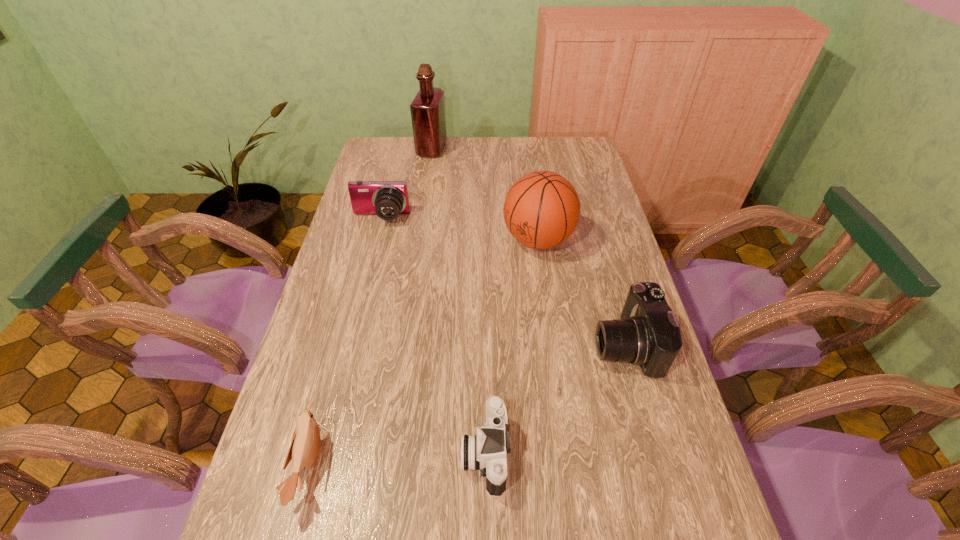
Where is `free location located 0.240m on the left of the basketball`? free location located 0.240m on the left of the basketball is located at coordinates (430, 240).

Locate an element on the screen. This screenshot has width=960, height=540. free space located 0.210m on the lens of the second farthest camera is located at coordinates (516, 345).

In order to click on vacant space located on the lens of the second farthest camera in this screenshot , I will do `click(467, 345)`.

Image resolution: width=960 pixels, height=540 pixels. Find the location of `free space located on the lens of the second farthest camera`. free space located on the lens of the second farthest camera is located at coordinates (485, 345).

At what (x,y) coordinates should I click in order to perform the action: click on free location located on the front-facing side of the leftmost camera. Please return your answer as a coordinate pair (x, y). This screenshot has width=960, height=540. Looking at the image, I should click on (368, 274).

Where is `vacant space located on the back of the nearest camera`? vacant space located on the back of the nearest camera is located at coordinates (485, 373).

You are a GUI agent. You are given a task and a screenshot of the screen. Output one action in this format:
    pyautogui.click(x=<x>, y=<y>)
    Task: Click on the free region located 0.120m at the beak of the bird
    
    Given the screenshot: What is the action you would take?
    pyautogui.click(x=379, y=465)

Locate an element on the screen. This screenshot has width=960, height=540. object located in the far edge section of the desktop is located at coordinates (427, 109).

Identify the location of camera located in the left edge section of the desktop. (387, 199).

Find the location of a particular element. bird located at the left edge is located at coordinates (305, 446).